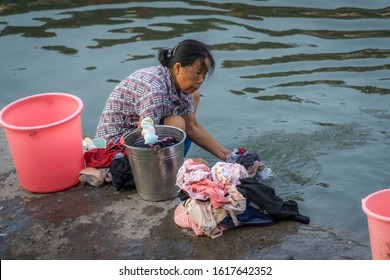
Identify the location of clothes pile. The width and height of the screenshot is (390, 280). (198, 188), (103, 162).